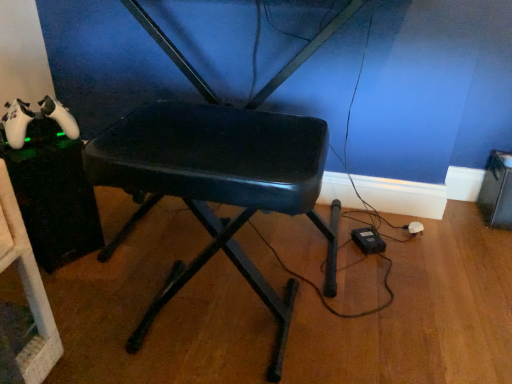
The height and width of the screenshot is (384, 512). Identify the location of free region on the left part of matte black stool at center. (98, 307).